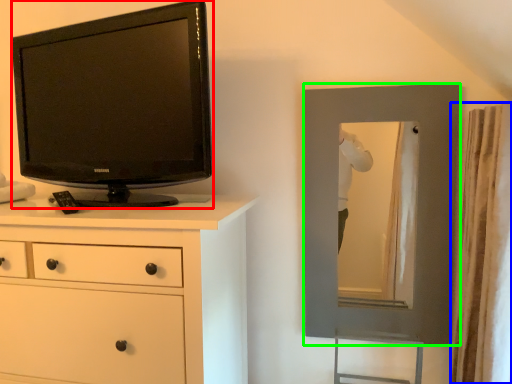
Question: Which object is positioned farthest from television (highlighted by a red box)? Select from curtain (highlighted by a blue box) and picture frame (highlighted by a green box).

Choices:
 (A) curtain
 (B) picture frame

Answer: (A)